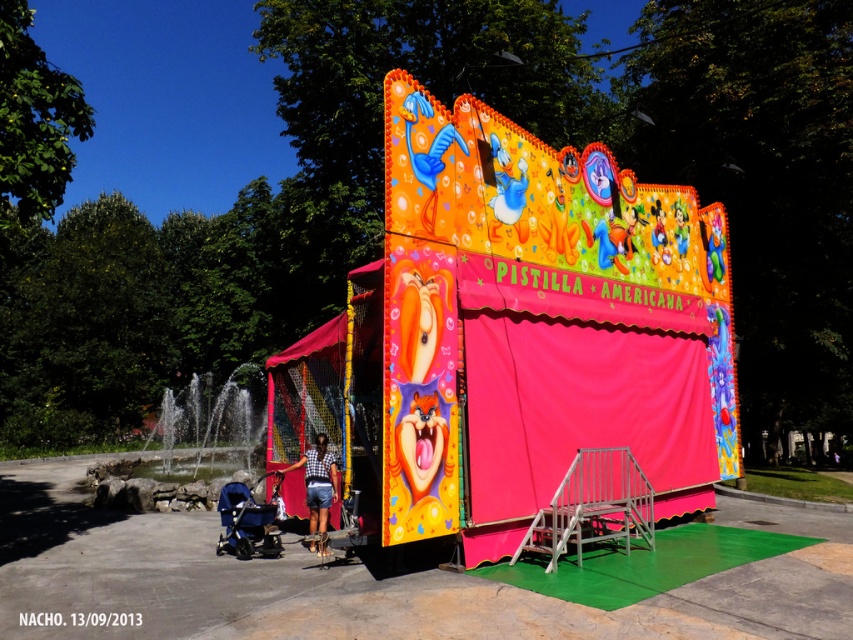
Which is in front, point (570, 449) or point (281, 545)?

Point (570, 449)

Which is behind, point (585, 186) or point (256, 538)?

The point (585, 186) is more distant.

Locate an element on the screen. This screenshot has width=853, height=640. vibrant plastic carnival booth at center is located at coordinates (538, 324).

Does vibrant plastic carnival booth at center appear over denim shorts at center?

Indeed, vibrant plastic carnival booth at center is positioned over denim shorts at center.

How far apart are vibrant plastic carnival booth at center and denim shorts at center?

The distance of vibrant plastic carnival booth at center from denim shorts at center is 11.53 feet.

Which is in front, point (404, 147) or point (318, 451)?

Point (404, 147)

Find the location of a particular element. The image size is (853, 640). vibrant plastic carnival booth at center is located at coordinates (538, 324).

Does point (267, 556) lie behind point (328, 468)?

No, (267, 556) is in front of (328, 468).

Does matte black stroller at lower left appear over denim shorts at center?

No.

Does point (265, 548) lie in front of point (334, 461)?

Yes.

Where is `matte black stroller at lower left`? matte black stroller at lower left is located at coordinates (247, 524).